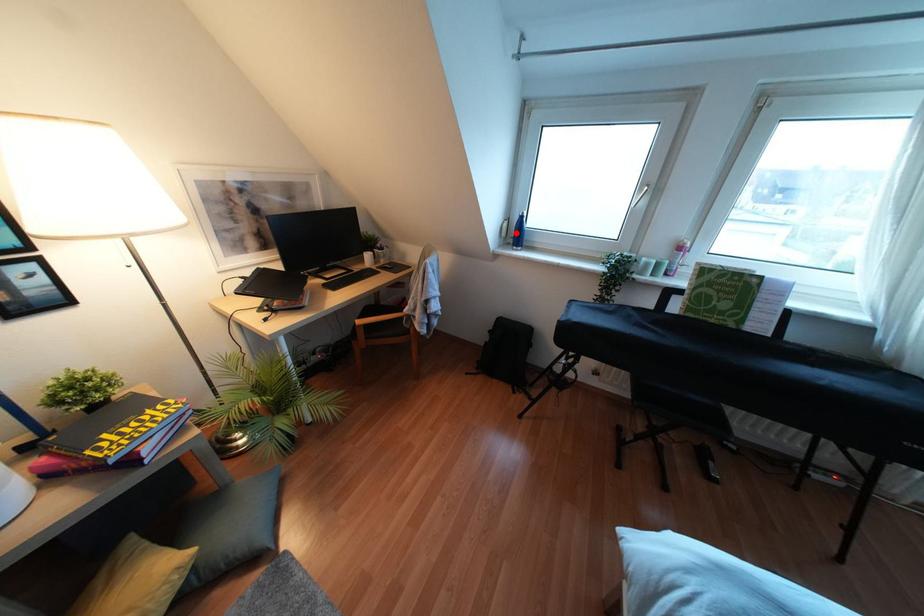
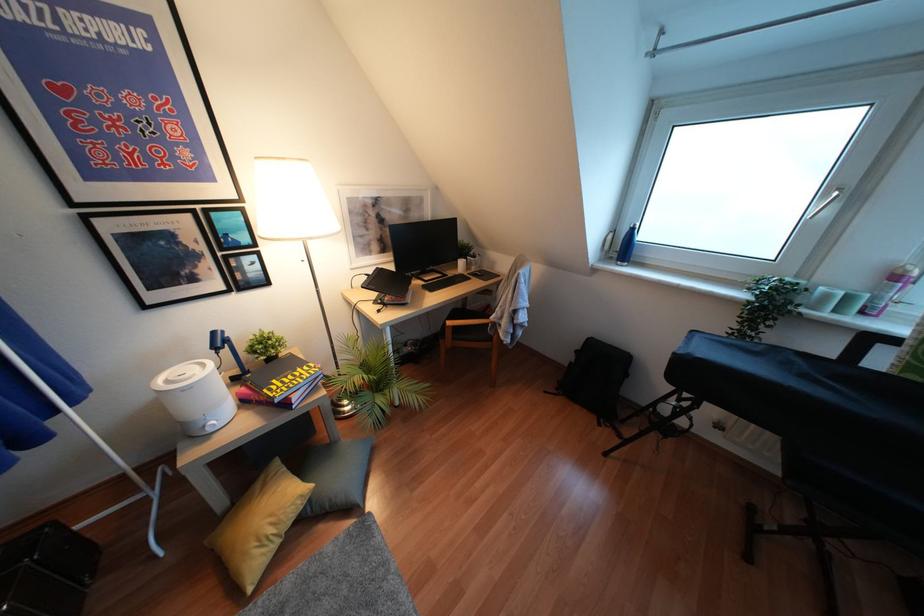
Locate, in the second image, the point that corresponds to the highlighted location in the first image.

(623, 246)